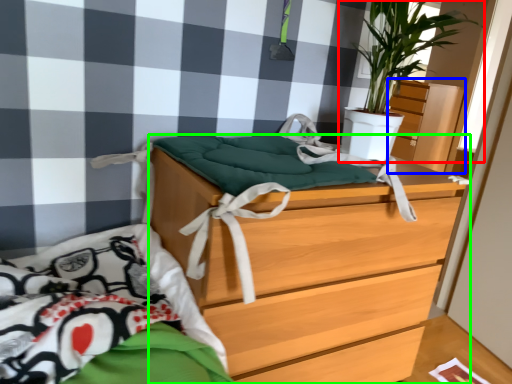
Question: Which object is positioned farthest from houseplant (highlighted by a red box)? Select from dresser (highlighted by a blue box) and chest of drawers (highlighted by a green box).

Choices:
 (A) dresser
 (B) chest of drawers

Answer: (A)